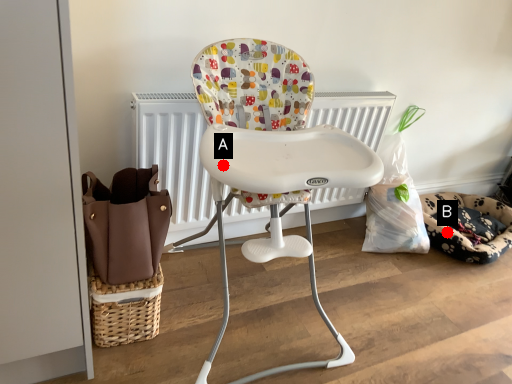
Question: Two points are circled on the image, labeled by A and B beside each circle. Which point is closer to the camera taking this photo?

Choices:
 (A) A is closer
 (B) B is closer

Answer: (A)